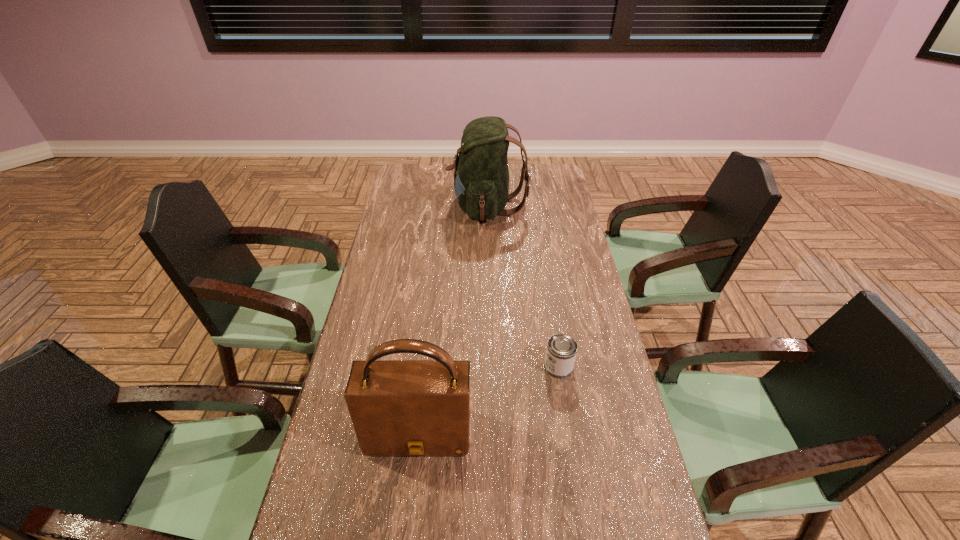
You are a GUI agent. You are given a task and a screenshot of the screen. Output one action in this format:
    pyautogui.click(x=<x>, y=<y>)
    Task: Click on the object that is the closest to the nearest object
    The width and height of the screenshot is (960, 540).
    Given the screenshot: What is the action you would take?
    pyautogui.click(x=561, y=351)

I want to click on vacant region that satisfies the following two spatial constraints: 1. on the open flap of the farthest object; 2. on the right side of the shortest object, so click(x=491, y=367).